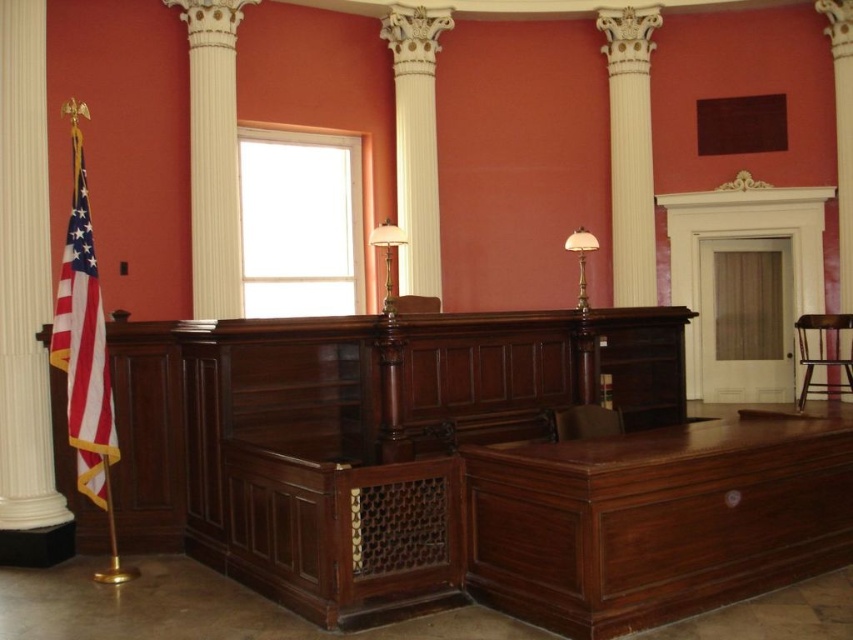
Question: Considering the real-world distances, which object is closest to the translucent glass lamp at center?

Choices:
 (A) white glossy column at upper left
 (B) matte gold table lamp at center

Answer: (B)

Question: Which point is farther to the camera?

Choices:
 (A) (647, 108)
 (B) (583, 237)
 (C) (384, 227)
 (D) (91, 372)

Answer: (A)

Question: Does red-white-striped fabric flag at left come behind wooden bar stool at right?

Choices:
 (A) no
 (B) yes

Answer: (A)

Question: Which point appears farthest from the camera in this image?

Choices:
 (A) (703, 570)
 (B) (822, 387)
 (C) (424, 301)
 (D) (643, 16)

Answer: (D)

Question: Can you confirm if red-white-striped fabric flag at left is smaller than white glossy column at center?

Choices:
 (A) no
 (B) yes

Answer: (B)

Question: Is brown wood chair at lower center positioned at the back of matte gold table lamp at center?

Choices:
 (A) yes
 (B) no

Answer: (B)